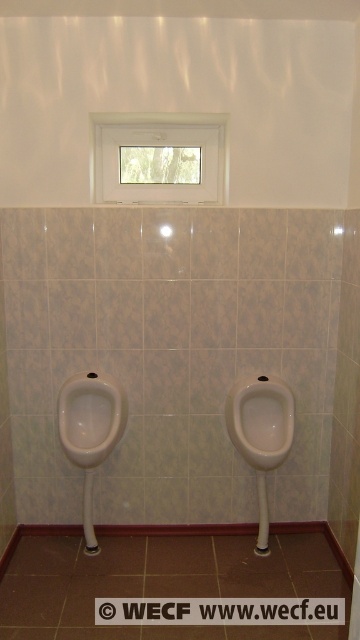
Question: Which point is closer to the camera?

Choices:
 (A) coord(239,426)
 (B) coord(114,387)

Answer: (A)

Question: Can you confirm if white glossy urinal at left is positioned below white glossy urinal at center?

Choices:
 (A) no
 (B) yes

Answer: (A)

Question: Among these objects, which one is nearest to the camera?

Choices:
 (A) white glossy urinal at center
 (B) white glossy urinal at left

Answer: (B)

Question: Does white glossy urinal at left come behind white glossy urinal at center?

Choices:
 (A) no
 (B) yes

Answer: (A)

Question: Does white glossy urinal at left appear over white glossy urinal at center?

Choices:
 (A) no
 (B) yes

Answer: (B)